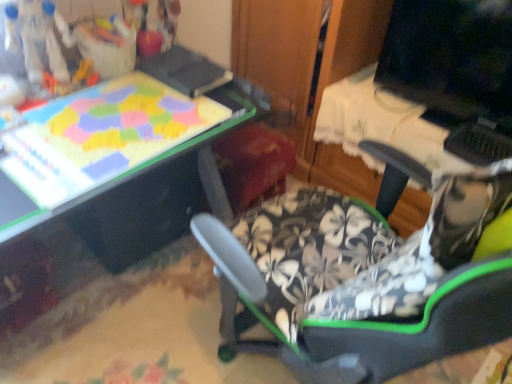
Image resolution: width=512 pixels, height=384 pixels. In order to click on black plastic drawer at lower left in this screenshot , I will do `click(141, 213)`.

Find the location of a particular element. This screenshot has width=512, height=384. matte black monitor at upper right is located at coordinates click(x=451, y=59).

Where is `computer monitor above the matte plastic puzzle board at upper left (from a real-world perspective)`? Image resolution: width=512 pixels, height=384 pixels. computer monitor above the matte plastic puzzle board at upper left (from a real-world perspective) is located at coordinates (451, 59).

Which is closer to the camera, [109,159] or [446,69]?

Point [109,159] is positioned closer to the camera compared to point [446,69].

From the image's perspective, is matte plastic puzzle board at upper left located above or below matte black monitor at upper right?

Based on their image positions, matte plastic puzzle board at upper left is located beneath matte black monitor at upper right.

Is black plastic drawer at lower left not near matte black monitor at upper right?

black plastic drawer at lower left is far away from matte black monitor at upper right.

From a real-world perspective, between black plastic drawer at lower left and matte black monitor at upper right, who is vertically higher?

In real-world perspective, matte black monitor at upper right is above.

Choose the correct answer: Is black plastic drawer at lower left inside matte black monitor at upper right or outside it?

black plastic drawer at lower left is located beyond the bounds of matte black monitor at upper right.

Can you confirm if black plastic drawer at lower left is bigger than matte black monitor at upper right?

Yes.

Would you say matte plastic puzzle board at upper left is outside black plastic drawer at lower left?

Yes.

Which is more to the right, matte plastic puzzle board at upper left or black plastic drawer at lower left?

matte plastic puzzle board at upper left is more to the right.

Which of these two, matte plastic puzzle board at upper left or black plastic drawer at lower left, stands taller?

Standing taller between the two is black plastic drawer at lower left.

Is matte plastic puzzle board at upper left touching black plastic drawer at lower left?

They are not placed beside each other.

From a real-world perspective, is matte black monitor at upper right beneath matte plastic puzzle board at upper left?

No.

From the picture: Is matte black monitor at upper right at the right side of matte plastic puzzle board at upper left?

Yes, matte black monitor at upper right is to the right of matte plastic puzzle board at upper left.

In order to click on table directly beneath the matte black monitor at upper right (from a real-world perspective) in this screenshot , I will do `click(119, 164)`.

Considering the relative positions of black plastic drawer at lower left and matte plastic puzzle board at upper left in the image provided, is black plastic drawer at lower left to the left of matte plastic puzzle board at upper left from the viewer's perspective?

Correct, you'll find black plastic drawer at lower left to the left of matte plastic puzzle board at upper left.

How distant is black plastic drawer at lower left from matte plastic puzzle board at upper left?

black plastic drawer at lower left is 15.75 inches from matte plastic puzzle board at upper left.

Is the surface of black plastic drawer at lower left in direct contact with matte plastic puzzle board at upper left?

black plastic drawer at lower left and matte plastic puzzle board at upper left are not in contact.

Consider the image. Between black plastic drawer at lower left and matte plastic puzzle board at upper left, which one is positioned in front?

matte plastic puzzle board at upper left is in front.

Does matte black monitor at upper right touch black plastic drawer at lower left?

No, matte black monitor at upper right is not beside black plastic drawer at lower left.

Considering the relative positions of matte black monitor at upper right and black plastic drawer at lower left in the image provided, is matte black monitor at upper right behind black plastic drawer at lower left?

No, matte black monitor at upper right is closer to the viewer.

At what (x,y) coordinates should I click in order to perform the action: click on computer monitor that appears on the right of black plastic drawer at lower left. Please return your answer as a coordinate pair (x, y). Image resolution: width=512 pixels, height=384 pixels. Looking at the image, I should click on (451, 59).

From a real-world perspective, relative to black plastic drawer at lower left, is matte black monitor at upper right vertically above or below?

From a real-world perspective, matte black monitor at upper right is physically above black plastic drawer at lower left.

Where is `table to the left of matte black monitor at upper right`? This screenshot has height=384, width=512. table to the left of matte black monitor at upper right is located at coordinates (119, 164).

You are a GUI agent. You are given a task and a screenshot of the screen. Output one action in this format:
    pyautogui.click(x=<x>, y=<y>)
    Task: Click on the computer monitor positioned vertically above the black plastic drawer at lower left (from a real-world perspective)
    
    Given the screenshot: What is the action you would take?
    pyautogui.click(x=451, y=59)

Looking at the image, which one is located further to matte plastic puzzle board at upper left, black plastic drawer at lower left or matte black monitor at upper right?

Among the two, matte black monitor at upper right is located further to matte plastic puzzle board at upper left.

From the image, which object appears to be farther from matte black monitor at upper right, black plastic drawer at lower left or matte plastic puzzle board at upper left?

black plastic drawer at lower left.

From the image, which object appears to be farther from matte black monitor at upper right, matte plastic puzzle board at upper left or black plastic drawer at lower left?

black plastic drawer at lower left lies further to matte black monitor at upper right than the other object.

Considering their positions, is matte plastic puzzle board at upper left positioned further to black plastic drawer at lower left than matte black monitor at upper right?

matte black monitor at upper right.

Looking at the image, which one is located further to matte plastic puzzle board at upper left, matte black monitor at upper right or black plastic drawer at lower left?

Based on the image, matte black monitor at upper right appears to be further to matte plastic puzzle board at upper left.

Which object lies further to the anchor point black plastic drawer at lower left, matte black monitor at upper right or matte plastic puzzle board at upper left?

Based on the image, matte black monitor at upper right appears to be further to black plastic drawer at lower left.

Identify the location of table between black plastic drawer at lower left and matte black monitor at upper right in the horizontal direction. (119, 164).